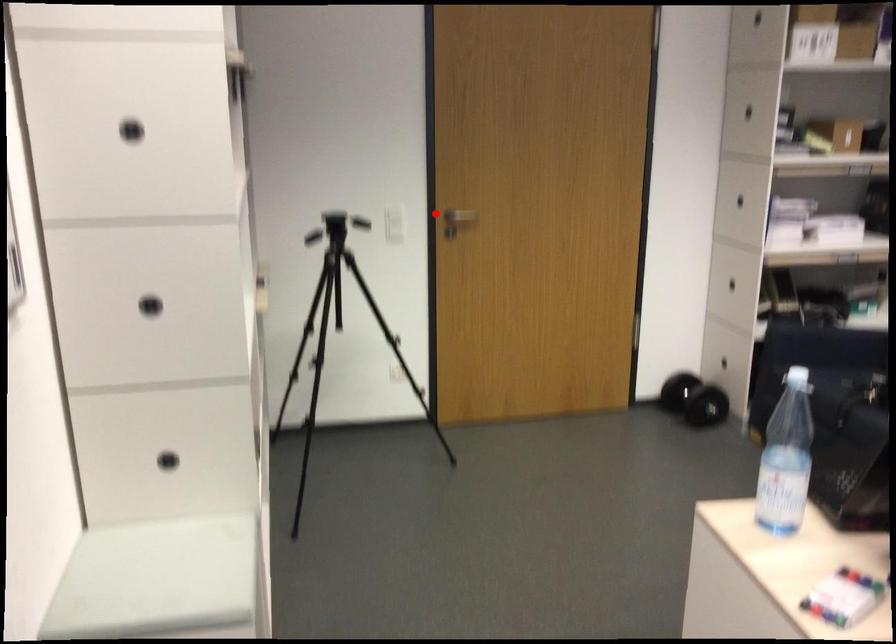
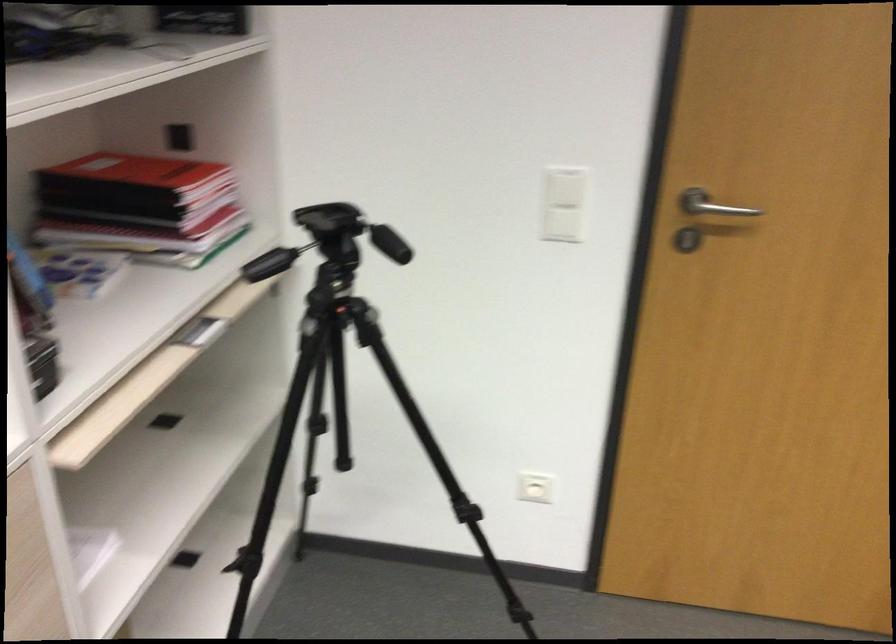
Question: I am providing you with two images of the same scene from different viewpoints. Given a red point in image1, look at the same physical point in image2. Is it:

Choices:
 (A) Closer to the viewpoint
 (B) Farther from the viewpoint

Answer: (A)